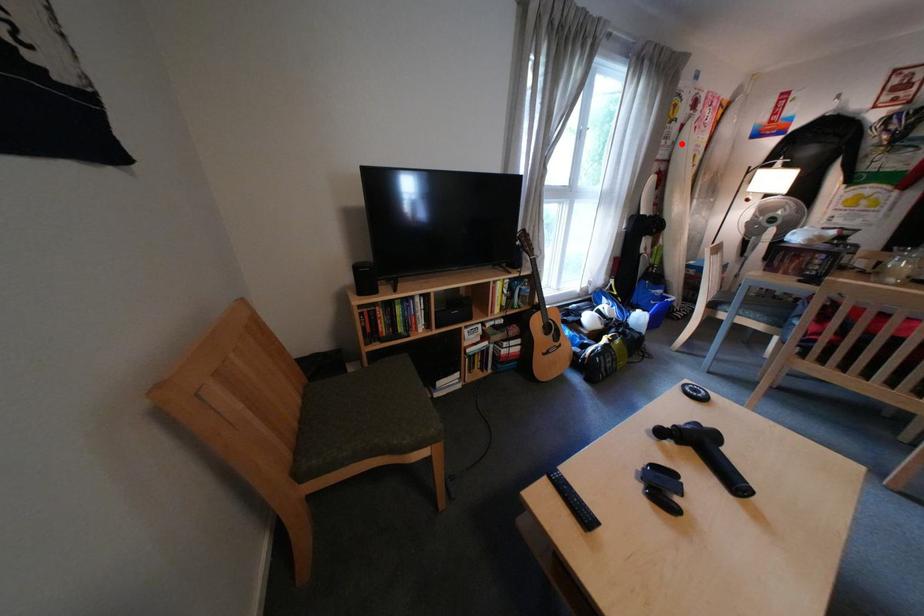
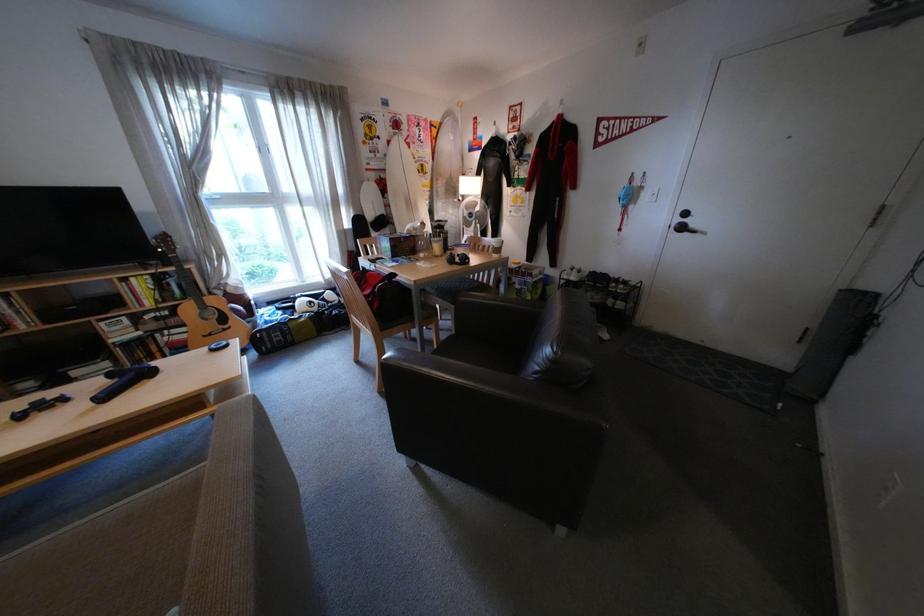
Question: I am providing you with two images of the same scene from different viewpoints. Image1 has a red point marked. In image2, the corresponding 3D location appears at what relative position? Reply with the corresponding letter.

Choices:
 (A) Closer
 (B) Farther

Answer: (A)